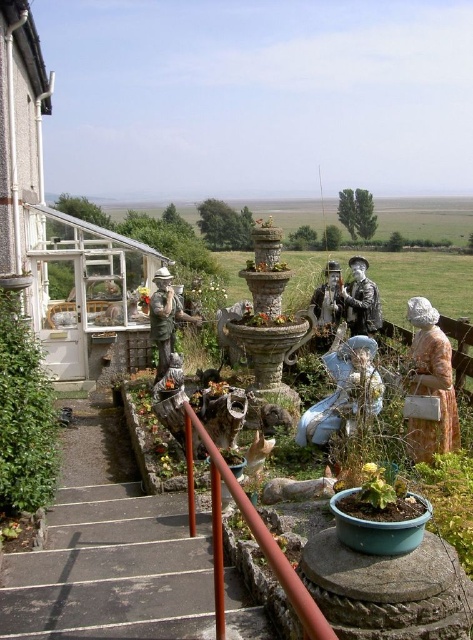
From the picture: Who is positioned more to the left, concrete steps at lower left or shiny silver statue at center?

concrete steps at lower left

Does concrete steps at lower left appear over shiny silver statue at center?

Actually, concrete steps at lower left is below shiny silver statue at center.

What do you see at coordinates (112, 570) in the screenshot? I see `concrete steps at lower left` at bounding box center [112, 570].

You are a GUI agent. You are given a task and a screenshot of the screen. Output one action in this format:
    pyautogui.click(x=<x>, y=<y>)
    Task: Click on the concrete steps at lower left
    
    Given the screenshot: What is the action you would take?
    pyautogui.click(x=112, y=570)

Who is more forward, (166,308) or (364,310)?

Positioned in front is point (166,308).

Find the location of `matte bronze statue at center-left`. matte bronze statue at center-left is located at coordinates (166, 317).

Can you confirm if matte orange dress at right is positioned above porcelain statue at center?

Yes.

Consider the image. Is matte orange dress at right further to the viewer compared to porcelain statue at center?

No.

Describe the element at coordinates (430, 384) in the screenshot. This screenshot has height=640, width=473. I see `matte orange dress at right` at that location.

Find the location of `matte orange dress at right`. matte orange dress at right is located at coordinates (430, 384).